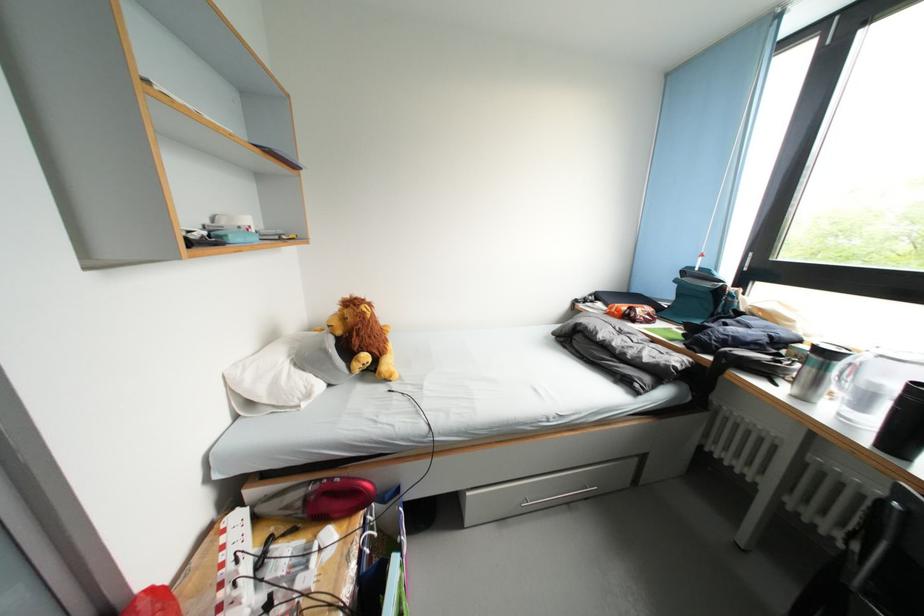
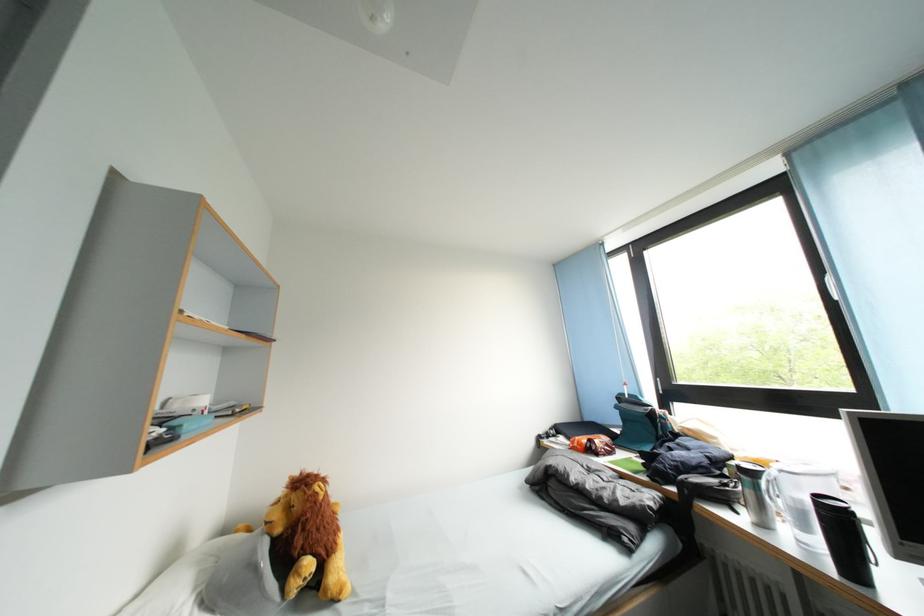
Find the pixel in the second image that matches [347,338] in the first image.

(287, 535)